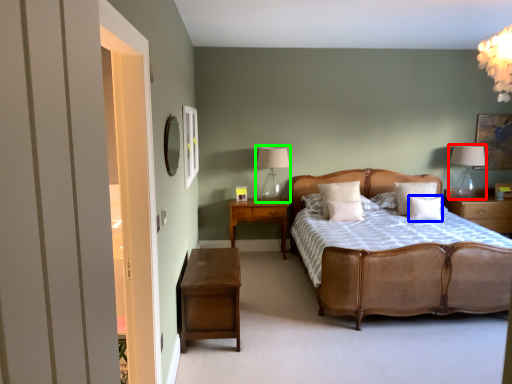
Question: Which object is positioned closest to table lamp (highlighted by a red box)? Select from pillow (highlighted by a blue box) and table lamp (highlighted by a green box).

Choices:
 (A) pillow
 (B) table lamp

Answer: (A)